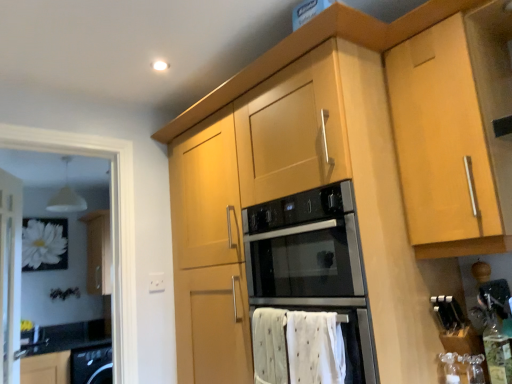
Question: Is white cotton bath towel at lower center bigger than white glossy sink at lower left?

Choices:
 (A) no
 (B) yes

Answer: (A)

Question: Can you confirm if white cotton bath towel at lower center is smaller than white glossy sink at lower left?

Choices:
 (A) yes
 (B) no

Answer: (A)

Question: From a real-world perspective, is white cotton bath towel at lower center over white glossy sink at lower left?

Choices:
 (A) no
 (B) yes

Answer: (B)

Question: Is white cotton bath towel at lower center oriented away from white glossy sink at lower left?

Choices:
 (A) no
 (B) yes

Answer: (A)

Question: Can you confirm if white cotton bath towel at lower center is positioned to the right of white glossy sink at lower left?

Choices:
 (A) yes
 (B) no

Answer: (A)

Question: From the image's perspective, is white cotton bath towel at lower center located above white glossy sink at lower left?

Choices:
 (A) yes
 (B) no

Answer: (A)

Question: From the image's perspective, is white glossy sink at lower left over white cotton bath towel at lower center?

Choices:
 (A) yes
 (B) no

Answer: (B)

Question: From a real-world perspective, is white glossy sink at lower left located beneath white cotton bath towel at lower center?

Choices:
 (A) no
 (B) yes

Answer: (B)

Question: From a real-world perspective, is white glossy sink at lower left located higher than white cotton bath towel at lower center?

Choices:
 (A) yes
 (B) no

Answer: (B)

Question: Does white glossy sink at lower left have a smaller size compared to white cotton bath towel at lower center?

Choices:
 (A) yes
 (B) no

Answer: (B)

Question: Does white glossy sink at lower left have a lesser width compared to white cotton bath towel at lower center?

Choices:
 (A) no
 (B) yes

Answer: (A)

Question: Are white glossy sink at lower left and white cotton bath towel at lower center located far from each other?

Choices:
 (A) no
 (B) yes

Answer: (B)

Question: Could you tell me if white plastic electric outlet at lower center is turned towards white cotton bath towel at lower center?

Choices:
 (A) no
 (B) yes

Answer: (B)